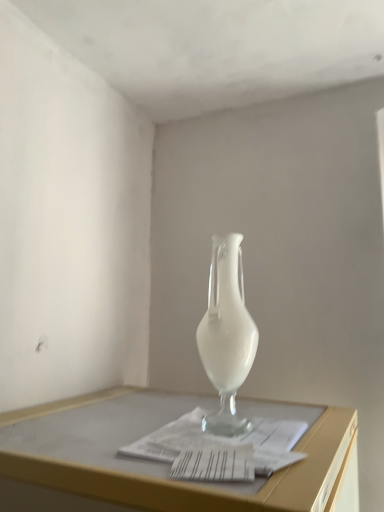
This screenshot has width=384, height=512. What are the coordinates of `vacant space in front of white glass vase at center` in the screenshot? It's located at (220, 454).